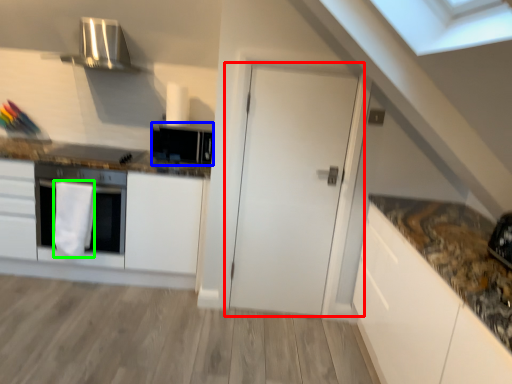
Question: Estimate the real-world distances between objects in this image. Which object is closer to door (highlighted by a red box), appliance (highlighted by a blue box) or material (highlighted by a green box)?

Choices:
 (A) appliance
 (B) material

Answer: (A)